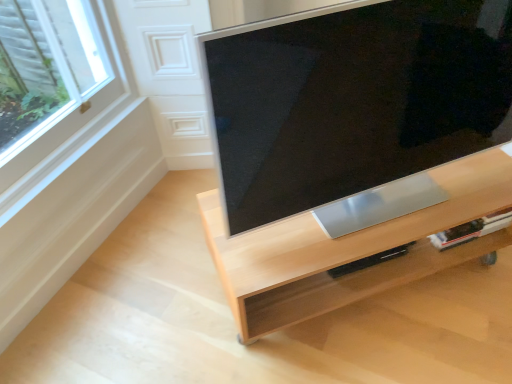
Where is `vacant space underneath satin silver tv at center (from a real-world perspective)`? The height and width of the screenshot is (384, 512). vacant space underneath satin silver tv at center (from a real-world perspective) is located at coordinates pos(390,206).